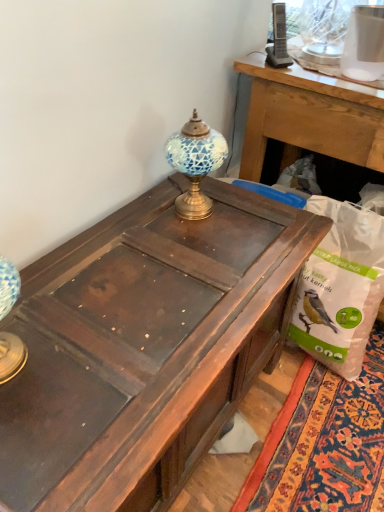
Image resolution: width=384 pixels, height=512 pixels. What do you see at coordinates (195, 163) in the screenshot? I see `blue mosaic glass at center` at bounding box center [195, 163].

This screenshot has height=512, width=384. Describe the element at coordinates (340, 287) in the screenshot. I see `white plastic bag at lower right` at that location.

I want to click on blue mosaic glass at center, so click(195, 163).

In the scene shown: Which of these two, blue mosaic glass at center or dark brown wood desk at center, is smaller?

With smaller size is blue mosaic glass at center.

How many degrees apart are the facing directions of blue mosaic glass at center and dark brown wood desk at center?

The angle between the facing direction of blue mosaic glass at center and the facing direction of dark brown wood desk at center is 1.25 degrees.

Does blue mosaic glass at center appear on the right side of dark brown wood desk at center?

Yes.

Which is further, (x=202, y=136) or (x=122, y=271)?

Positioned behind is point (x=202, y=136).

Is there a large distance between white plastic bag at lower right and dark brown wood desk at center?

No, white plastic bag at lower right is in close proximity to dark brown wood desk at center.

Consider the image. Is white plastic bag at lower right facing away from dark brown wood desk at center?

That's not correct — white plastic bag at lower right is not looking away from dark brown wood desk at center.

Is point (303, 323) farther from camera compared to point (235, 193)?

Yes, it is behind point (235, 193).

Image resolution: width=384 pixels, height=512 pixels. Identify the location of desk that is below the white plastic bag at lower right (from the image's perspective). (144, 346).

What's the angular difference between dark brown wood desk at center and white plastic bag at lower right's facing directions?

The angular difference between dark brown wood desk at center and white plastic bag at lower right is 91 degrees.

Is white plastic bag at lower right located within dark brown wood desk at center?

No, white plastic bag at lower right is not surrounded by dark brown wood desk at center.

Between point (66, 330) and point (315, 296), which one is positioned in front?

The point (66, 330) is closer.

Which is farther from the camera, (308, 210) or (190, 125)?

The point (308, 210) is farther.

From a real-world perspective, is white plastic bag at lower right located higher than blue mosaic glass at center?

No, from a real-world perspective, white plastic bag at lower right is not above blue mosaic glass at center.

Is white plastic bag at lower right facing away from blue mosaic glass at center?

No, white plastic bag at lower right is not facing the opposite direction of blue mosaic glass at center.

Consider the image. What's the angular difference between white plastic bag at lower right and blue mosaic glass at center's facing directions?

The facing directions of white plastic bag at lower right and blue mosaic glass at center are 92.3 degrees apart.

Is blue mosaic glass at center far from white plastic bag at lower right?

No.

What's the angular difference between blue mosaic glass at center and white plastic bag at lower right's facing directions?

There is a 92.3-degree angle between the facing directions of blue mosaic glass at center and white plastic bag at lower right.

Based on their sizes in the image, would you say blue mosaic glass at center is bigger or smaller than white plastic bag at lower right?

Clearly, blue mosaic glass at center is smaller in size than white plastic bag at lower right.

Can you confirm if blue mosaic glass at center is shorter than white plastic bag at lower right?

Yes, blue mosaic glass at center is shorter than white plastic bag at lower right.

Which is correct: dark brown wood desk at center is inside blue mosaic glass at center, or outside of it?

The correct answer is: outside.

Which object is thinner, dark brown wood desk at center or blue mosaic glass at center?

Thinner between the two is blue mosaic glass at center.

Identify the location of lamp above the dark brown wood desk at center (from the image's perspective). Image resolution: width=384 pixels, height=512 pixels. (195, 163).

Find the location of a particular element. lamp above the dark brown wood desk at center (from the image's perspective) is located at coordinates (195, 163).

Locate an element on the screen. paper bag located on the right of dark brown wood desk at center is located at coordinates (340, 287).

Based on their spatial positions, is dark brown wood desk at center or white plastic bag at lower right further from blue mosaic glass at center?

white plastic bag at lower right is further to blue mosaic glass at center.

Considering their positions, is blue mosaic glass at center positioned further to white plastic bag at lower right than dark brown wood desk at center?

Based on the image, blue mosaic glass at center appears to be further to white plastic bag at lower right.

When comparing their distances from dark brown wood desk at center, does blue mosaic glass at center or white plastic bag at lower right seem further?

white plastic bag at lower right lies further to dark brown wood desk at center than the other object.

Which object lies nearer to the anchor point white plastic bag at lower right, dark brown wood desk at center or blue mosaic glass at center?

Among the two, dark brown wood desk at center is located nearer to white plastic bag at lower right.

Estimate the real-world distances between objects in this image. Which object is further from blue mosaic glass at center, white plastic bag at lower right or dark brown wood desk at center?

white plastic bag at lower right is positioned further to the anchor blue mosaic glass at center.

Considering their positions, is white plastic bag at lower right positioned closer to dark brown wood desk at center than blue mosaic glass at center?

blue mosaic glass at center.

Image resolution: width=384 pixels, height=512 pixels. Find the location of `lamp located between dark brown wood desk at center and white plastic bag at lower right in the left-right direction`. lamp located between dark brown wood desk at center and white plastic bag at lower right in the left-right direction is located at coordinates tap(195, 163).